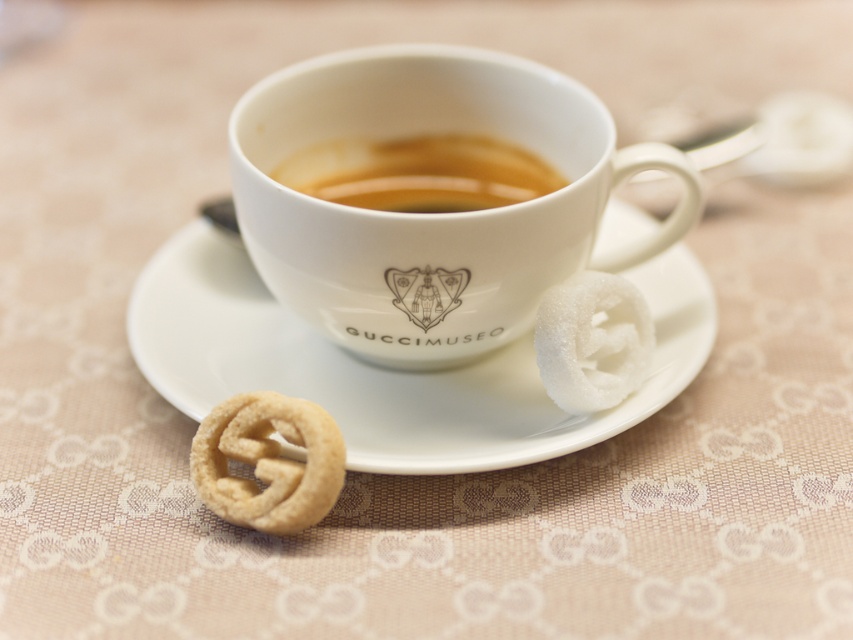
Who is taller, white ceramic saucer at center or golden-brown pretzel at lower left?

white ceramic saucer at center

Which of these two, white ceramic saucer at center or golden-brown pretzel at lower left, stands shorter?

golden-brown pretzel at lower left

Which is behind, point (202, 243) or point (299, 403)?

Point (202, 243)

The width and height of the screenshot is (853, 640). Identify the location of white ceramic saucer at center. 389,369.

Who is more forward, (697,216) or (631,220)?

Point (697,216) is in front.

How far apart are white porcelain cup at center and white ceramic saucer at center?

white porcelain cup at center is 6.19 inches away from white ceramic saucer at center.

Image resolution: width=853 pixels, height=640 pixels. What are the coordinates of `white porcelain cup at center` in the screenshot? It's located at tap(433, 212).

The height and width of the screenshot is (640, 853). I want to click on white porcelain cup at center, so click(433, 212).

Which is in front, point (358, 157) or point (280, 509)?

Point (280, 509) is in front.

Which of these two, brown liquid at center or golden-brown pretzel at lower left, stands shorter?

brown liquid at center

Locate an element on the screen. This screenshot has height=640, width=853. brown liquid at center is located at coordinates (419, 173).

At what (x,y) coordinates should I click in order to perform the action: click on brown liquid at center. Please return your answer as a coordinate pair (x, y). This screenshot has height=640, width=853. Looking at the image, I should click on (419, 173).